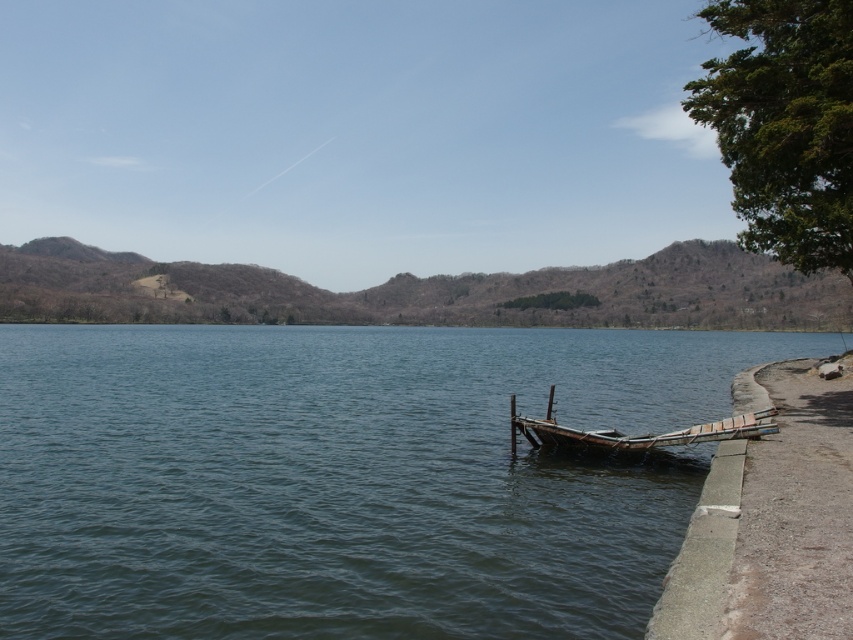
Question: Is blue water at lower left thinner than wooden boat at lower right?

Choices:
 (A) no
 (B) yes

Answer: (A)

Question: Is blue water at lower left below wooden boat at lower right?

Choices:
 (A) no
 (B) yes

Answer: (A)

Question: Among these points, which one is nearest to the camera?

Choices:
 (A) (682, 429)
 (B) (251, 381)

Answer: (A)

Question: Is the position of blue water at lower left less distant than that of wooden boat at lower right?

Choices:
 (A) no
 (B) yes

Answer: (B)